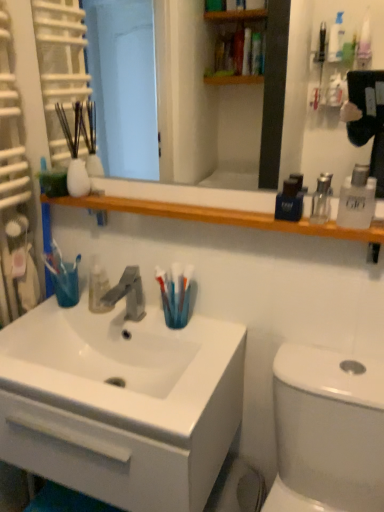
Question: Does clear glass mouthwash at upper right, the second mouthwash positioned from the right, come behind clear plastic bottle at right, marked as the first mouthwash in a right-to-left arrangement?

Choices:
 (A) yes
 (B) no

Answer: (A)

Question: From a real-world perspective, is clear glass mouthwash at upper right, placed as the 2th mouthwash when sorted from left to right, located higher than clear plastic bottle at right, marked as the third mouthwash in a left-to-right arrangement?

Choices:
 (A) yes
 (B) no

Answer: (B)

Question: From a real-world perspective, does clear glass mouthwash at upper right, placed as the 2th mouthwash when sorted from left to right, sit lower than clear plastic bottle at right, marked as the first mouthwash in a right-to-left arrangement?

Choices:
 (A) no
 (B) yes

Answer: (B)

Question: Does clear glass mouthwash at upper right, the second mouthwash positioned from the right, have a lesser width compared to clear plastic bottle at right, marked as the first mouthwash in a right-to-left arrangement?

Choices:
 (A) no
 (B) yes

Answer: (B)

Question: Is clear glass mouthwash at upper right, placed as the 2th mouthwash when sorted from left to right, facing towards clear plastic bottle at right, marked as the third mouthwash in a left-to-right arrangement?

Choices:
 (A) yes
 (B) no

Answer: (B)

Question: From a real-world perspective, relative to wooden shelf at upper center, is white glossy cabinet at lower left vertically above or below?

Choices:
 (A) above
 (B) below

Answer: (B)

Question: Looking at their shapes, would you say white glossy cabinet at lower left is wider or thinner than wooden shelf at upper center?

Choices:
 (A) thin
 (B) wide

Answer: (B)

Question: Considering the positions of point (142, 336) and point (336, 224), is point (142, 336) closer or farther from the camera than point (336, 224)?

Choices:
 (A) farther
 (B) closer

Answer: (A)

Question: From the image's perspective, relative to wooden shelf at upper center, is white glossy cabinet at lower left above or below?

Choices:
 (A) above
 (B) below

Answer: (B)

Question: Considering the positions of blue plastic toothbrush at sink and white glossy cabinet at lower left in the image, is blue plastic toothbrush at sink bigger or smaller than white glossy cabinet at lower left?

Choices:
 (A) big
 (B) small

Answer: (B)

Question: Is point (175, 298) closer or farther from the camera than point (150, 343)?

Choices:
 (A) farther
 (B) closer

Answer: (B)

Question: From the image's perspective, is blue plastic toothbrush at sink above or below white glossy cabinet at lower left?

Choices:
 (A) below
 (B) above

Answer: (B)

Question: Choose the correct answer: Is blue plastic toothbrush at sink inside white glossy cabinet at lower left or outside it?

Choices:
 (A) outside
 (B) inside

Answer: (A)

Question: Is clear glass mouthwash at upper right, the second mouthwash positioned from the right, in front of or behind satin nickel faucet at center in the image?

Choices:
 (A) front
 (B) behind

Answer: (A)

Question: Does point (327, 205) appear closer or farther from the camera than point (89, 304)?

Choices:
 (A) closer
 (B) farther

Answer: (A)